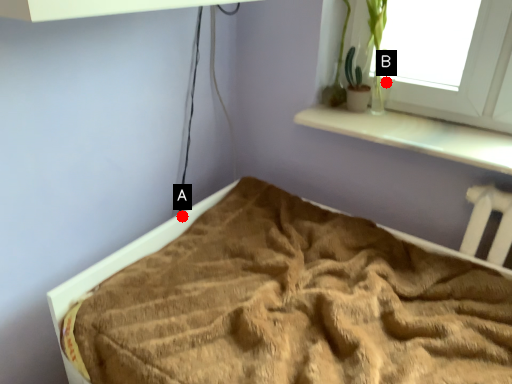
Question: Two points are circled on the image, labeled by A and B beside each circle. Among these points, which one is nearest to the camera?

Choices:
 (A) A is closer
 (B) B is closer

Answer: (A)